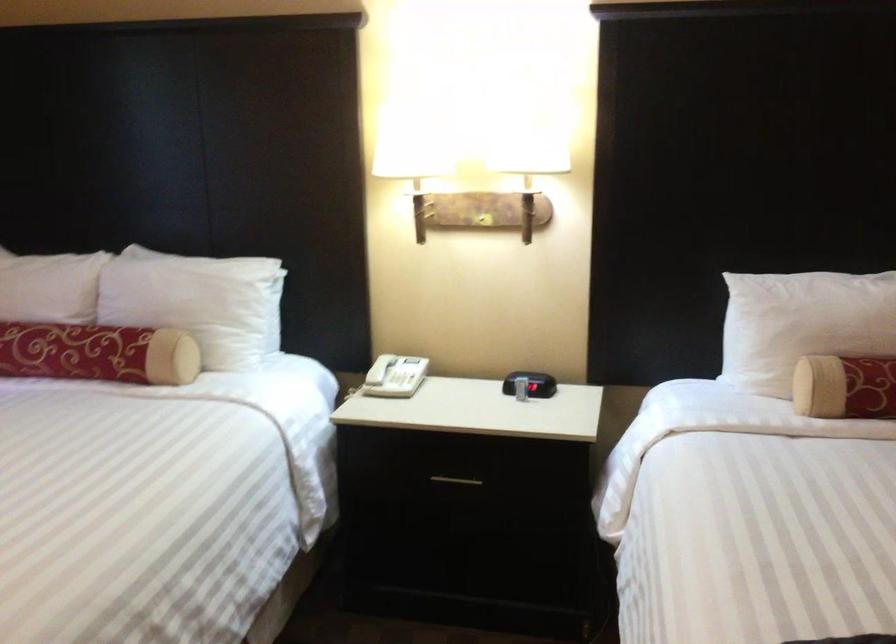
The height and width of the screenshot is (644, 896). I want to click on telephone handset, so click(380, 368).